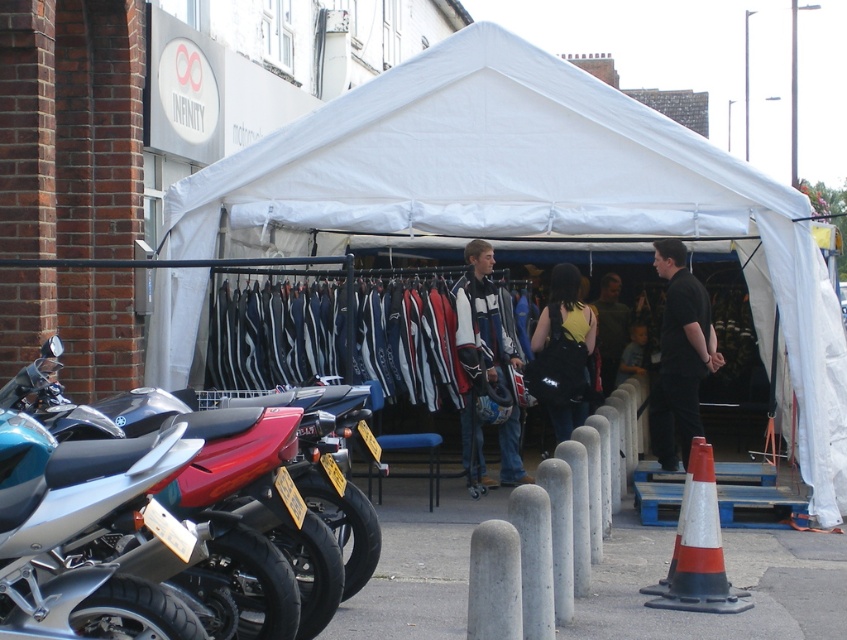
Based on the photo, does silver metallic motorcycle at left have a lesser width compared to white leather jacket at center?

Correct, silver metallic motorcycle at left's width is less than white leather jacket at center's.

This screenshot has height=640, width=847. What do you see at coordinates (214, 492) in the screenshot?
I see `silver metallic motorcycle at left` at bounding box center [214, 492].

You are a GUI agent. You are given a task and a screenshot of the screen. Output one action in this format:
    pyautogui.click(x=<x>, y=<y>)
    Task: Click on the silver metallic motorcycle at left
    Image resolution: width=847 pixels, height=640 pixels.
    Given the screenshot: What is the action you would take?
    pyautogui.click(x=214, y=492)

Which is more to the right, black fabric backpack at center or light blue denim jacket at center?

light blue denim jacket at center

Between black fabric backpack at center and light blue denim jacket at center, which one has less height?

light blue denim jacket at center is shorter.

Which is in front, point (583, 317) or point (627, 344)?

Positioned in front is point (583, 317).

Where is `black fabric backpack at center`? The image size is (847, 640). black fabric backpack at center is located at coordinates (562, 352).

Looking at this image, is dark green jacket at center further to camera compared to light blue denim jacket at center?

Yes, dark green jacket at center is behind light blue denim jacket at center.

Looking at this image, can you confirm if dark green jacket at center is wider than light blue denim jacket at center?

Yes.

Which is in front, point (601, 349) or point (641, 369)?

Positioned in front is point (641, 369).

Find the location of a particular element. This screenshot has width=847, height=640. dark green jacket at center is located at coordinates (610, 328).